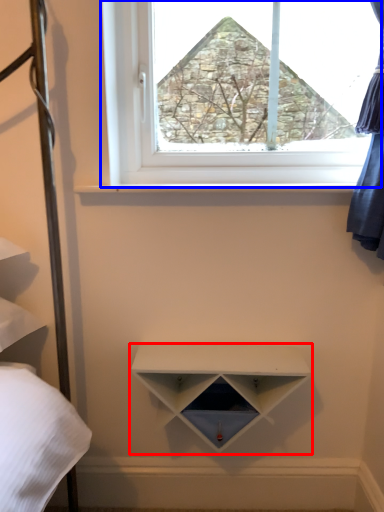
Question: Which of the following is the farthest to the observer, shelf (highlighted by a red box) or window (highlighted by a blue box)?

Choices:
 (A) shelf
 (B) window

Answer: (B)